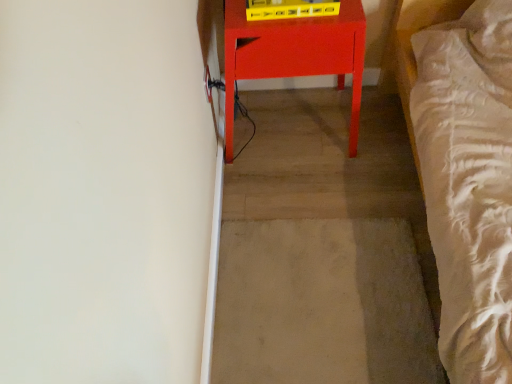
Question: Considering the relative sizes of beige carpet at center and matte red table at center in the image provided, is beige carpet at center smaller than matte red table at center?

Choices:
 (A) no
 (B) yes

Answer: (B)

Question: Does beige carpet at center have a lesser height compared to matte red table at center?

Choices:
 (A) no
 (B) yes

Answer: (B)

Question: Considering the relative sizes of beige carpet at center and matte red table at center in the image provided, is beige carpet at center thinner than matte red table at center?

Choices:
 (A) yes
 (B) no

Answer: (B)

Question: Is beige carpet at center not within matte red table at center?

Choices:
 (A) yes
 (B) no

Answer: (A)

Question: From the image's perspective, is beige carpet at center below matte red table at center?

Choices:
 (A) yes
 (B) no

Answer: (A)

Question: Does beige carpet at center lie behind matte red table at center?

Choices:
 (A) yes
 (B) no

Answer: (A)

Question: Does matte red table at center have a smaller size compared to beige carpet at center?

Choices:
 (A) yes
 (B) no

Answer: (B)

Question: Can we say matte red table at center lies outside beige carpet at center?

Choices:
 (A) yes
 (B) no

Answer: (A)

Question: Is matte red table at center at the right side of beige carpet at center?

Choices:
 (A) no
 (B) yes

Answer: (A)

Question: Does matte red table at center have a lesser width compared to beige carpet at center?

Choices:
 (A) yes
 (B) no

Answer: (A)

Question: Are matte red table at center and beige carpet at center far apart?

Choices:
 (A) yes
 (B) no

Answer: (B)

Question: Considering the relative sizes of matte red table at center and beige carpet at center in the image provided, is matte red table at center wider than beige carpet at center?

Choices:
 (A) no
 (B) yes

Answer: (A)

Question: In the image, is beige carpet at center positioned in front of or behind matte red table at center?

Choices:
 (A) front
 (B) behind

Answer: (B)